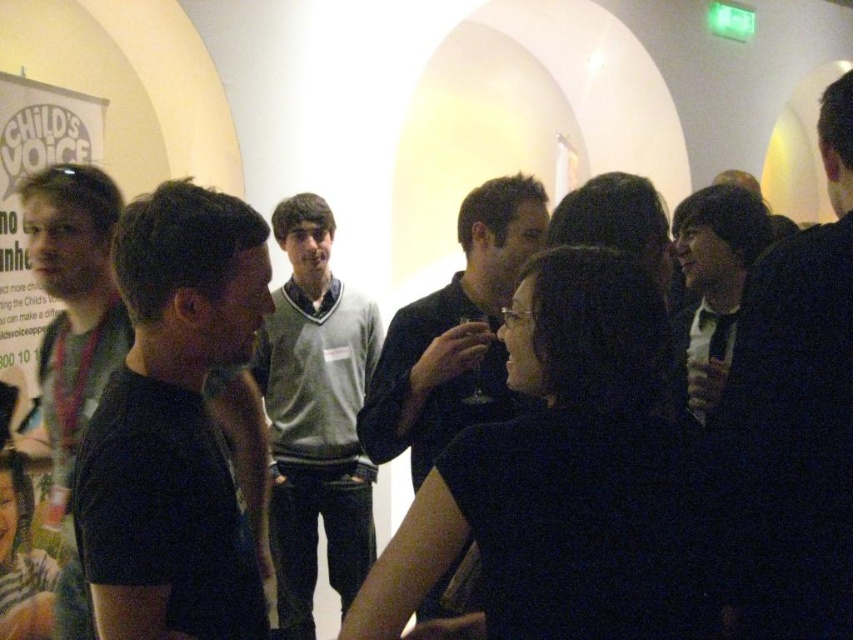
Question: Which object appears farthest from the camera in this image?

Choices:
 (A) black matte jacket at right
 (B) black matte shirt at left

Answer: (A)

Question: Does dark gray sweater at center appear on the right side of black matte jacket at right?

Choices:
 (A) no
 (B) yes

Answer: (A)

Question: Can you confirm if dark gray sweater at center is positioned above black matte jacket at right?

Choices:
 (A) no
 (B) yes

Answer: (A)

Question: Among these points, which one is farthest from the camera?

Choices:
 (A) (498, 177)
 (B) (289, 202)
 (C) (712, 376)

Answer: (B)

Question: Is dark hair at center bigger than gray sweater at center?

Choices:
 (A) yes
 (B) no

Answer: (B)

Question: Which object is closer to the camera taking this photo?

Choices:
 (A) dark hair at center
 (B) gray sweater at center
 (C) black matte jacket at right

Answer: (A)